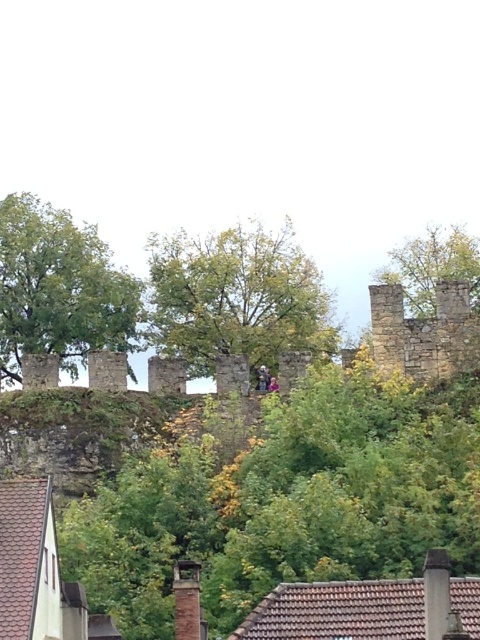
Question: Estimate the real-world distances between objects in this image. Which object is farther from the green leafy tree at upper center?

Choices:
 (A) stone wall at upper center
 (B) green leafy tree at upper right
 (C) green leafy tree at center

Answer: (B)

Question: Where is green leafy tree at upper center located in relation to green leafy tree at upper right in the image?

Choices:
 (A) above
 (B) below

Answer: (B)

Question: Can you confirm if stone wall at upper center is positioned below green leafy tree at upper center?

Choices:
 (A) yes
 (B) no

Answer: (A)

Question: Can you confirm if stone wall at upper center is positioned to the left of green leafy tree at upper right?

Choices:
 (A) yes
 (B) no

Answer: (A)

Question: Among these objects, which one is farthest from the camera?

Choices:
 (A) green leafy tree at center
 (B) green leafy tree at upper right
 (C) green leafy tree at upper center

Answer: (C)

Question: Which object is positioned farthest from the green leafy tree at upper center?

Choices:
 (A) stone wall at upper center
 (B) green leafy tree at upper right

Answer: (B)